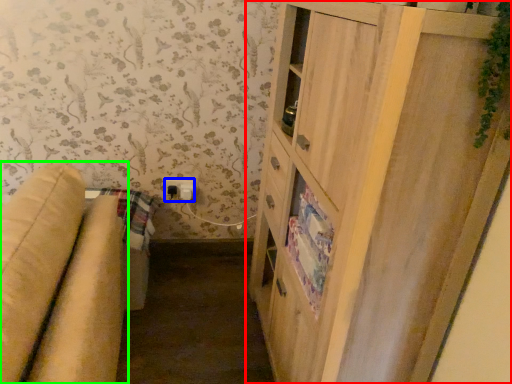
Question: Which object is the farthest from cupboard (highlighted by a red box)? Choose among these: electric outlet (highlighted by a blue box) or studio couch (highlighted by a green box).

Choices:
 (A) electric outlet
 (B) studio couch

Answer: (A)